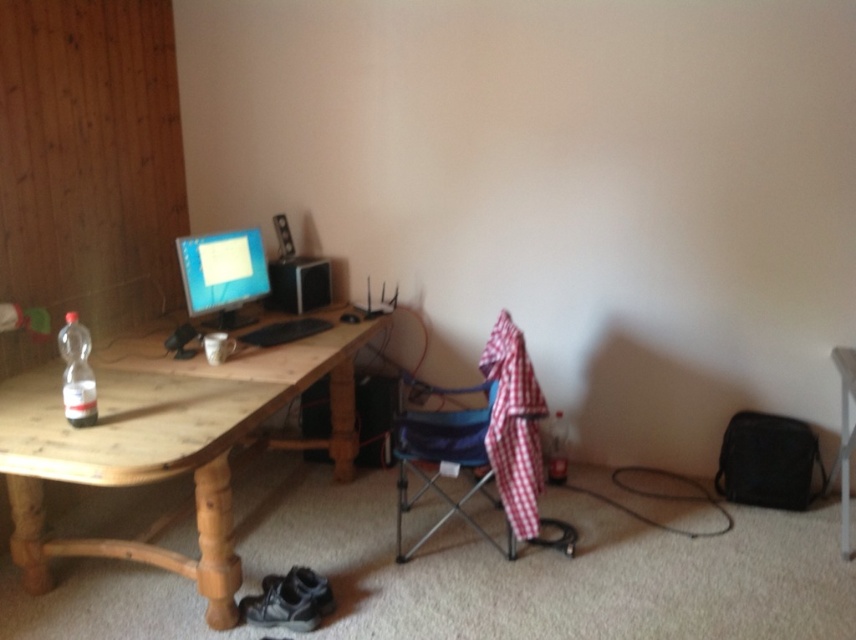
You are organizing items on the desk and need to place the clear plastic bottle at left. Where exactly should you position it?

The clear plastic bottle at left should be positioned at point (76, 372).

You are organizing items on the desk and need to place both the clear plastic bottle at left and the clear glass bottle at lower right. According to their positions, which one is located more to the left?

The clear plastic bottle at left is located more to the left than the clear glass bottle at lower right.